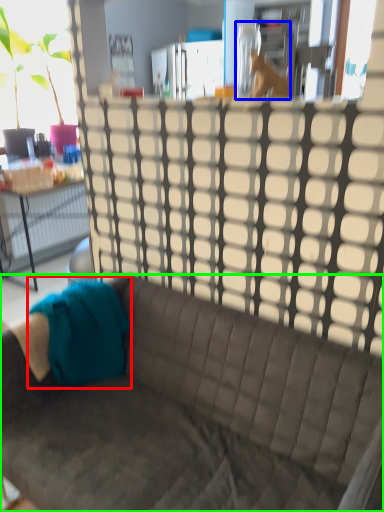
Question: Estimate the real-world distances between objects in this image. Which object is farther from fabric (highlighted by a red box), animal (highlighted by a blue box) or studio couch (highlighted by a green box)?

Choices:
 (A) animal
 (B) studio couch

Answer: (A)